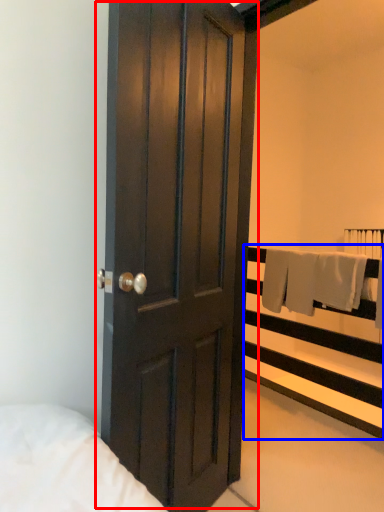
Question: Among these objects, which one is nearest to the camera, door (highlighted by a red box) or balustrade (highlighted by a blue box)?

Choices:
 (A) door
 (B) balustrade

Answer: (A)